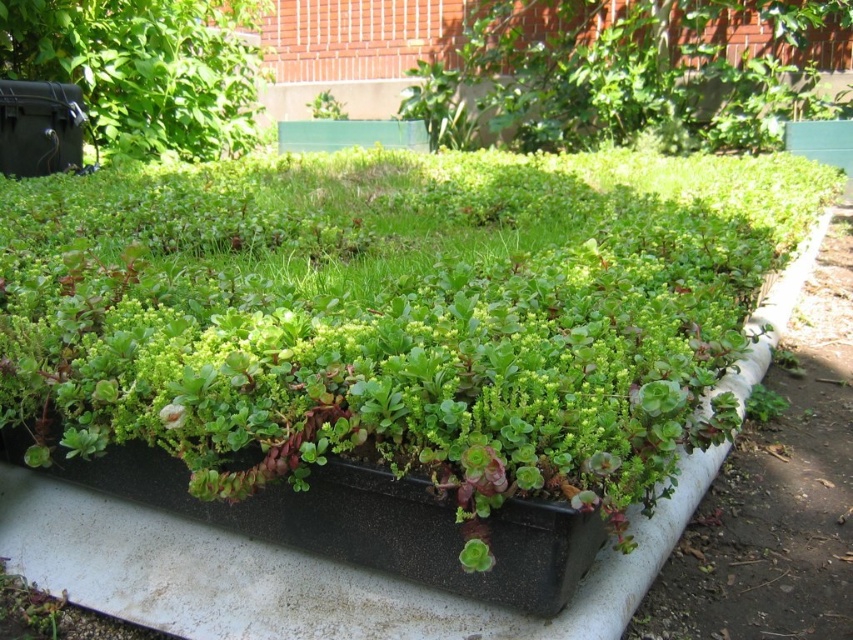
Question: Which point is closer to the camera taking this photo?

Choices:
 (A) (318, 92)
 (B) (788, 44)

Answer: (B)

Question: Based on their relative distances, which object is farther from the green succulent at center?

Choices:
 (A) green leafy plant at upper center
 (B) black plastic container at upper left

Answer: (A)

Question: Does black plastic container at upper left have a greater width compared to green succulent at center?

Choices:
 (A) no
 (B) yes

Answer: (B)

Question: Is green leafy plant at upper center to the left of green succulent at center from the viewer's perspective?

Choices:
 (A) yes
 (B) no

Answer: (B)

Question: Does green leafy plant at upper center lie in front of green succulent at center?

Choices:
 (A) no
 (B) yes

Answer: (B)

Question: Which of the following is the closest to the observer?

Choices:
 (A) green succulent at center
 (B) green leafy plant at upper center

Answer: (B)